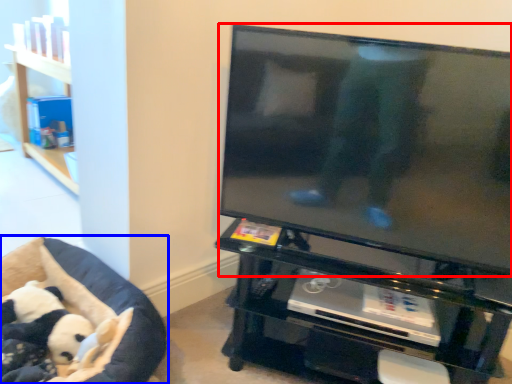
Question: Which object is closer to the camera taking this photo, television (highlighted by a red box) or furniture (highlighted by a blue box)?

Choices:
 (A) television
 (B) furniture

Answer: (A)